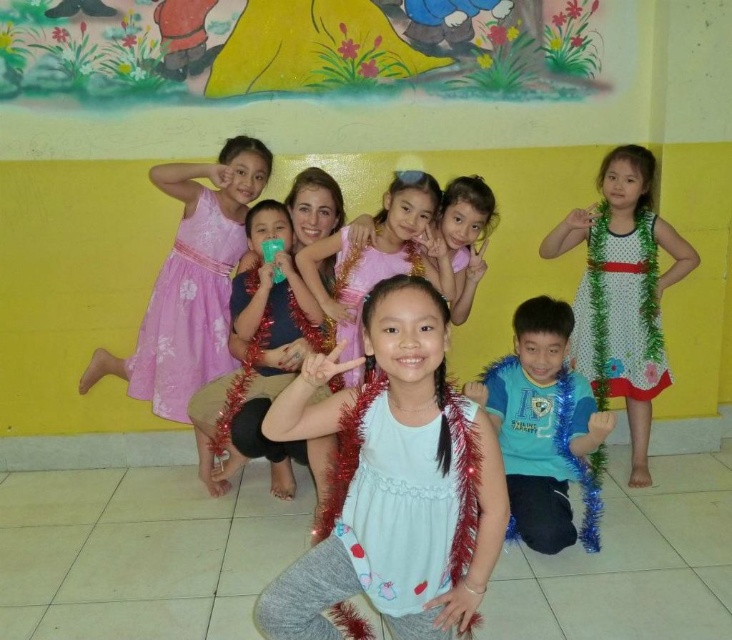
You are a photographer setting up for a group photo. You need to arrange the matte blue shirt at center and the white satin dress at center so that both are visible in the frame. Which one should be placed higher to ensure their faces are visible without obstruction?

The matte blue shirt at center is much taller than the white satin dress at center, so to ensure both faces are visible without obstruction, the white satin dress at center should be placed higher than the matte blue shirt at center.

You are standing in front of the yellow wall with the mural. You notice two points marked in the scene. Which point is closer to you, point (288, 497) or point (646, 257)?

Point (288, 497) is in front of point (646, 257), so it is closer to you.